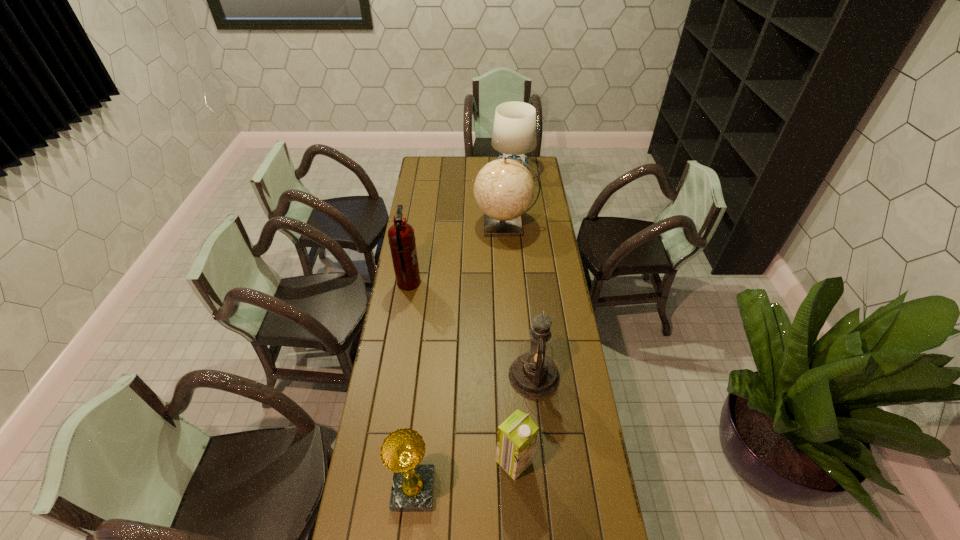
Find the location of a particular element. oil lamp situated at the right edge is located at coordinates (533, 374).

Identify the location of object that is at the far right corner. (514, 132).

Image resolution: width=960 pixels, height=540 pixels. In order to click on vacant space at the left edge of the desktop in this screenshot , I will do `click(434, 220)`.

The width and height of the screenshot is (960, 540). Identify the location of vacant point at the right edge. (x=561, y=371).

The image size is (960, 540). I want to click on blank space at the far left corner, so click(x=437, y=167).

Identify the location of vacant space in between the farthest object and the fire extinguisher. (461, 227).

You are a GUI agent. You are given a task and a screenshot of the screen. Output one action in this format:
    pyautogui.click(x=<x>, y=<y>)
    Task: Click on the vacant region between the farthest object and the soya milk
    The width and height of the screenshot is (960, 540).
    Given the screenshot: What is the action you would take?
    pyautogui.click(x=514, y=316)

The width and height of the screenshot is (960, 540). I want to click on unoccupied area between the third nearest object and the second object from left to right, so click(x=474, y=433).

You are a GUI agent. You are given a task and a screenshot of the screen. Output one action in this format:
    pyautogui.click(x=<x>, y=<y>)
    Task: Click on the vacant point located between the oil lamp and the fire extinguisher
    This screenshot has width=960, height=540.
    Given the screenshot: What is the action you would take?
    pyautogui.click(x=471, y=329)

Where is `empty location between the third nearest object and the fifth nearest object`? This screenshot has width=960, height=540. empty location between the third nearest object and the fifth nearest object is located at coordinates (519, 300).